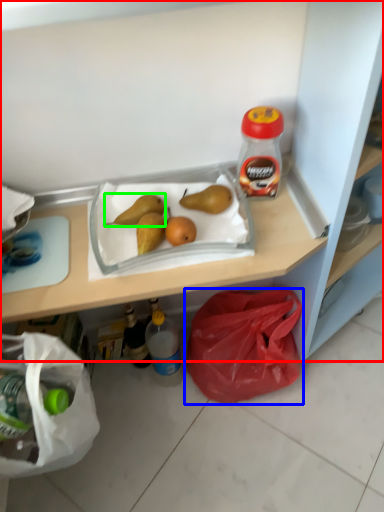
Question: Estimate the real-world distances between objects in this image. Which object is farther from shelf (highlighted by a red box), plastic bag (highlighted by a blue box) or pear (highlighted by a green box)?

Choices:
 (A) plastic bag
 (B) pear

Answer: (A)